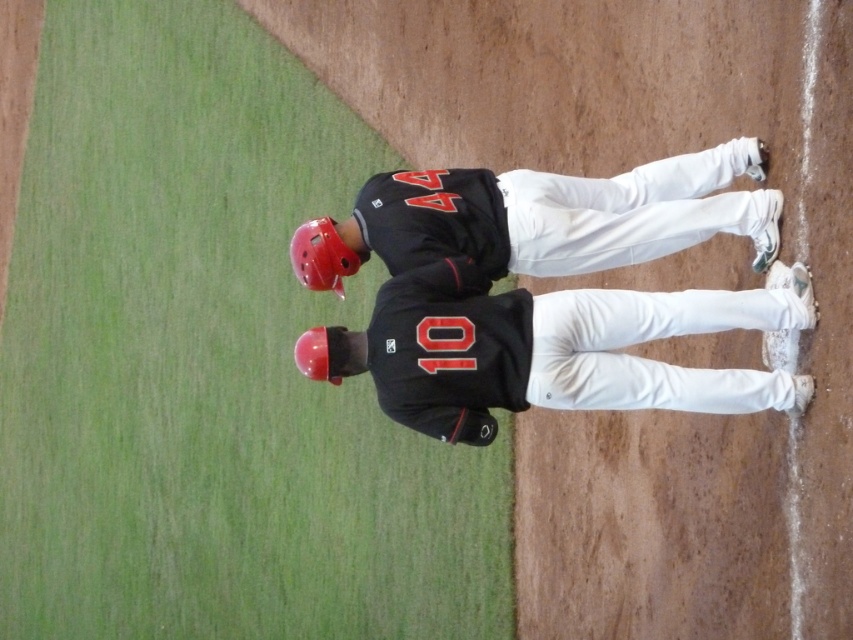
You are a coach standing at the center of the baseball field. You notice two points marked on the field where the players are standing. The first point is labeled as point 1 at coordinates (415,285) and the second point is labeled as point 2 at coordinates (335,340). Based on their positions, which point is closer to the home plate located at the origin of the coordinate system?

Point 1 at coordinates (415,285) is closer to the home plate located at the origin because it has a shorter distance compared to point 2 at coordinates (335,340).

You are a photographer trying to capture a closeup shot of both the black matte jersey at center and the rubber matte baseball glove at center. Since you want to ensure both objects are clearly visible in the frame, which object should you focus on first to account for their sizes?

The black matte jersey at center is bigger than the rubber matte baseball glove at center, so you should focus on the black matte jersey at center first to ensure its details are sharp before adjusting for the smaller glove.